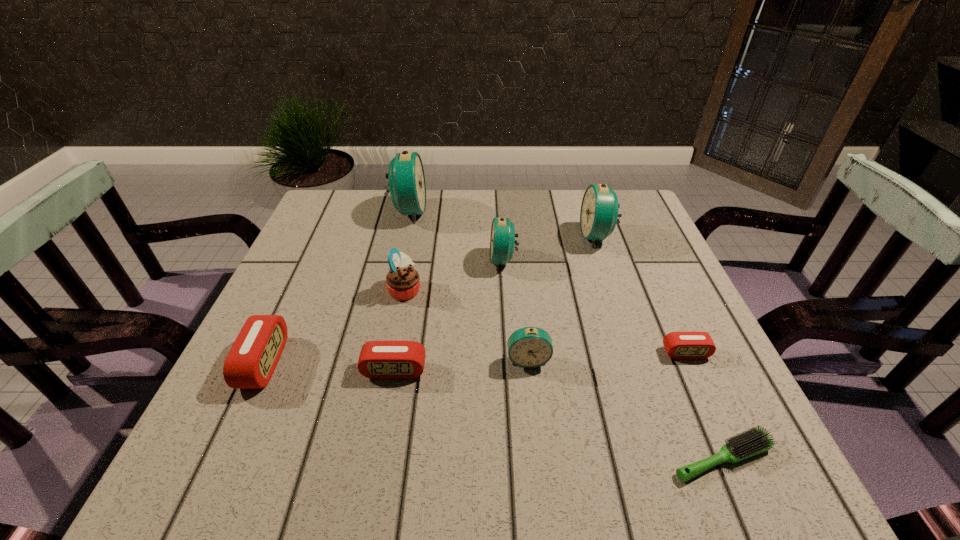
This screenshot has height=540, width=960. I want to click on vacant space at the near left corner, so click(249, 444).

Find the location of a particular element. blank space at the far right corner of the desktop is located at coordinates (645, 212).

Identify the location of free spot between the biggest blue alarm clock and the fourth farthest object. This screenshot has height=540, width=960. (407, 251).

Where is `vacant point located between the second smallest pink alarm clock and the third tallest alarm clock`? This screenshot has width=960, height=540. vacant point located between the second smallest pink alarm clock and the third tallest alarm clock is located at coordinates (448, 315).

Image resolution: width=960 pixels, height=540 pixels. In order to click on vacant space that is in between the rightmost pink alarm clock and the pink muffin in this screenshot , I will do `click(545, 321)`.

Find the location of `free spot between the tallest alarm clock and the nearest object`. free spot between the tallest alarm clock and the nearest object is located at coordinates (565, 335).

The width and height of the screenshot is (960, 540). I want to click on free space between the fifth tallest object and the rightmost blue alarm clock, so click(563, 298).

Locate an element on the screen. This screenshot has height=540, width=960. empty space between the third tallest alarm clock and the nearest object is located at coordinates (612, 359).

Identify the location of vacant area that lies between the third biggest blue alarm clock and the leftmost object. The image size is (960, 540). (384, 312).

Image resolution: width=960 pixels, height=540 pixels. What are the coordinates of `free space between the fourth farthest object and the fifth tallest object` in the screenshot? It's located at (467, 325).